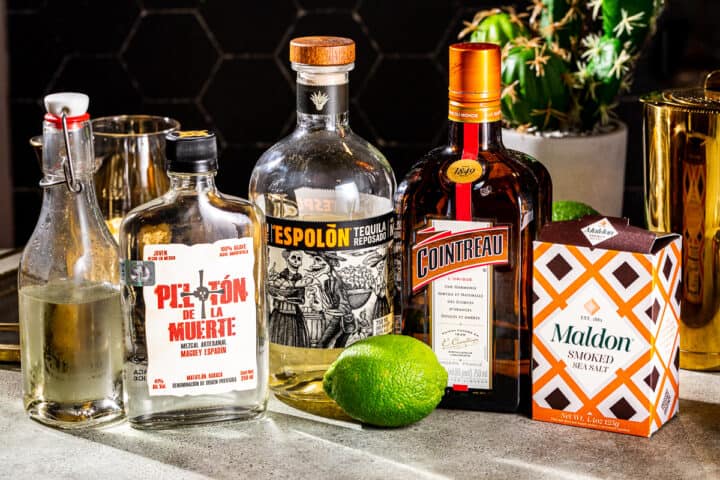
At what (x,y) coordinates should I click in order to perform the action: click on cork. Please return your answer as a coordinate pair (x, y). Looking at the image, I should click on (284, 81), (322, 76).